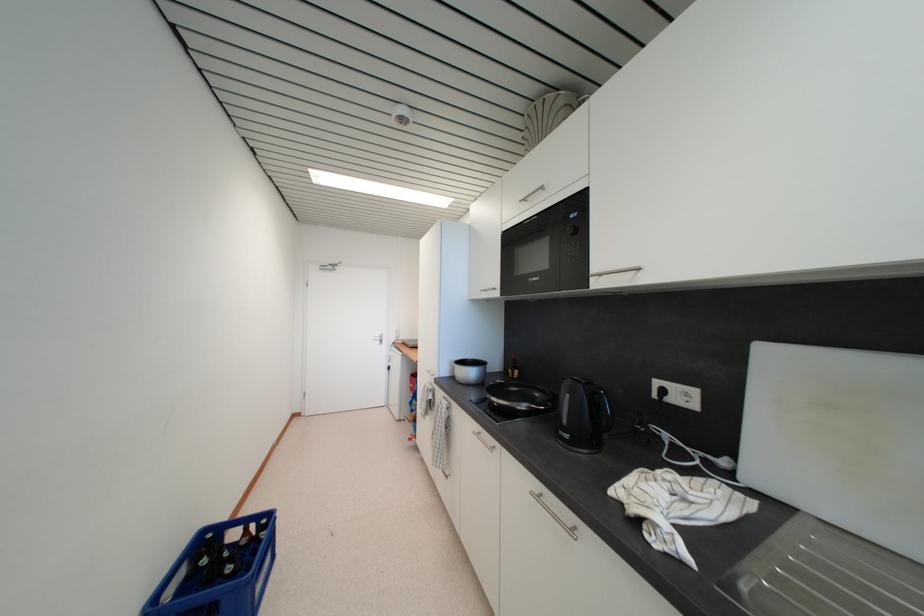
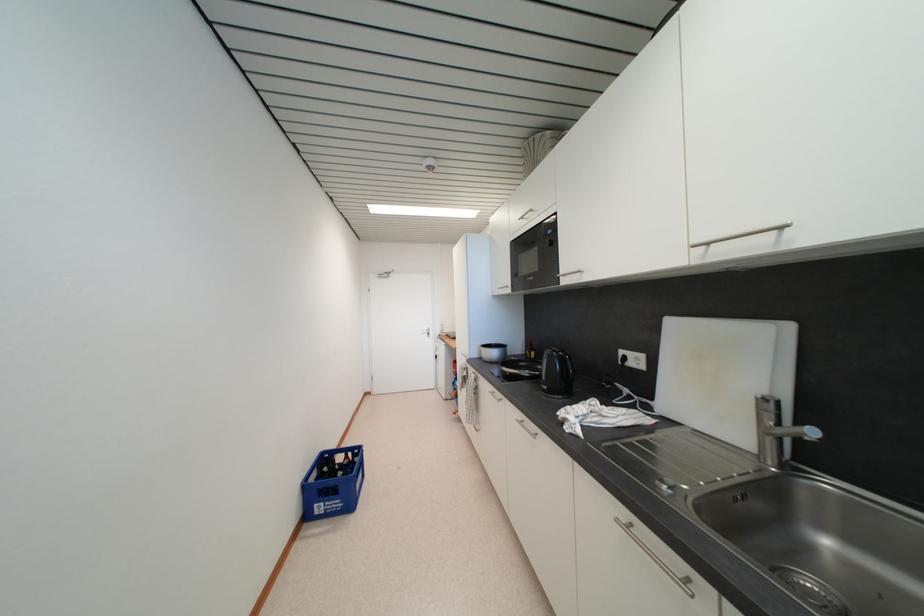
Question: The camera is either moving clockwise (left) or counter-clockwise (right) around the object. The first image is from the beginning of the video and the second image is from the end. Is the camera moving left or right when shooting the video?

Choices:
 (A) Left
 (B) Right

Answer: (B)